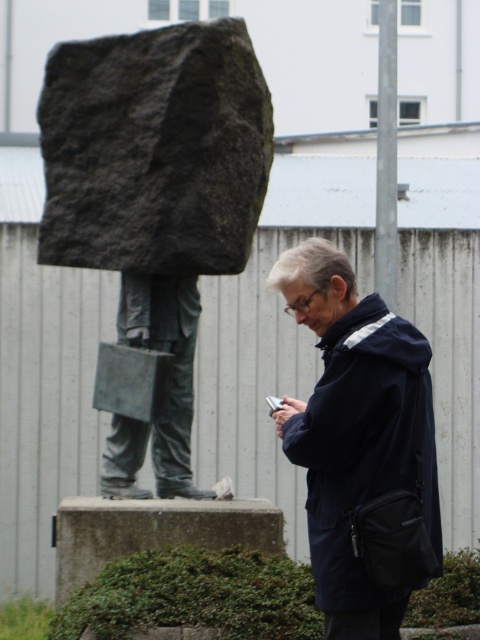
Does dark gray stone statue at center have a lesser width compared to navy blue jacket at center?

No.

The width and height of the screenshot is (480, 640). Find the location of `dark gray stone statue at center`. dark gray stone statue at center is located at coordinates (156, 186).

Between point (232, 113) and point (359, 516), which one is positioned behind?

Positioned behind is point (232, 113).

Locate an element on the screen. dark gray stone statue at center is located at coordinates (156, 186).

Does navy blue jacket at center have a lesser width compared to bronze statue at center?

No, navy blue jacket at center is not thinner than bronze statue at center.

Is point (424, 513) less distant than point (132, 451)?

Yes.

Identify the location of navy blue jacket at center. (358, 442).

Which is above, dark gray stone statue at center or gray concrete boulder at lower center?

dark gray stone statue at center is above.

Can you confirm if dark gray stone statue at center is positioned below gray concrete boulder at lower center?

No, dark gray stone statue at center is not below gray concrete boulder at lower center.

Is point (156, 332) in front of point (241, 538)?

No, it is behind (241, 538).

Locate an element on the screen. dark gray stone statue at center is located at coordinates pos(156,186).